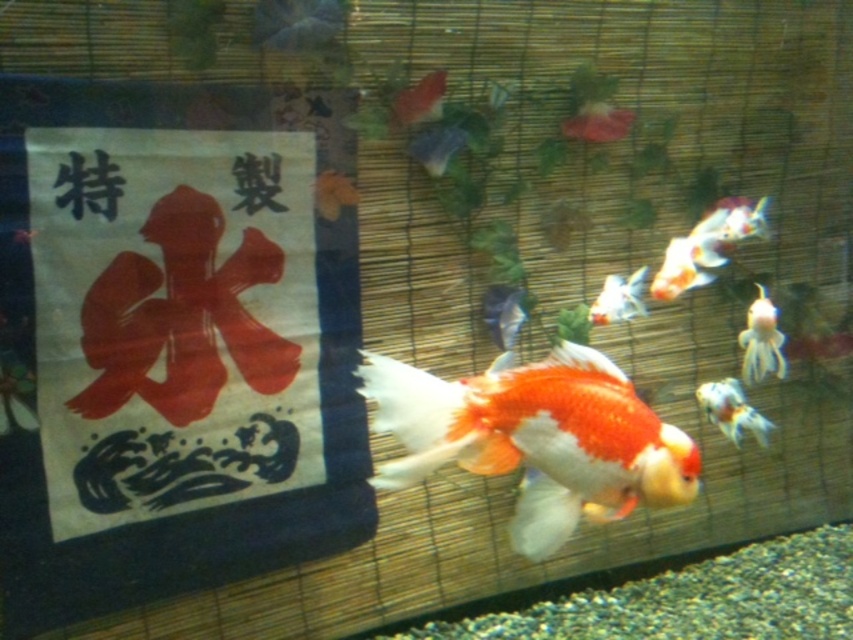
Question: Does shiny orange and white fish at center appear under white glossy goldfish at right?

Choices:
 (A) yes
 (B) no

Answer: (A)

Question: Which of the following is the farthest from the observer?

Choices:
 (A) white glossy goldfish at right
 (B) shiny orange and white fish at center
 (C) orange and white translucent goldfish at upper right

Answer: (A)

Question: Can you confirm if orange and white translucent goldfish at upper right is positioned to the right of orange glossy goldfish at lower right?

Choices:
 (A) no
 (B) yes

Answer: (A)

Question: Is orange glossy goldfish at lower right below translucent glass goldfish at upper right?

Choices:
 (A) yes
 (B) no

Answer: (A)

Question: Which object is farther from the camera taking this photo?

Choices:
 (A) white glossy goldfish at center
 (B) translucent glass goldfish at upper right

Answer: (B)

Question: Based on their relative distances, which object is farther from the white glossy goldfish at right?

Choices:
 (A) translucent glass goldfish at upper right
 (B) orange glossy goldfish at lower right
 (C) shiny orange and white fish at center

Answer: (C)